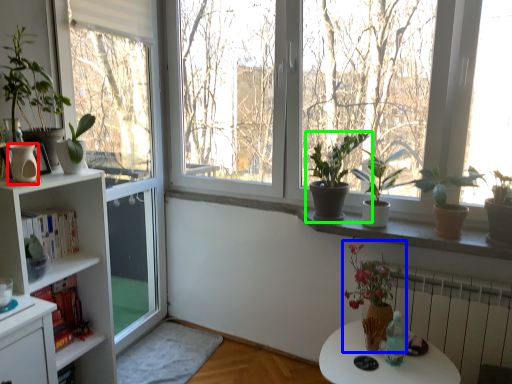
Question: Considering the real-world distances, which object is closest to vase (highlighted by a red box)? floral arrangement (highlighted by a blue box) or houseplant (highlighted by a green box).

Choices:
 (A) floral arrangement
 (B) houseplant

Answer: (B)